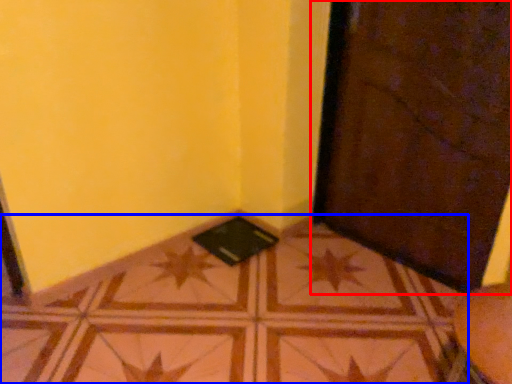
Question: Which of the following is the closest to the observer, door (highlighted by a red box) or tile (highlighted by a blue box)?

Choices:
 (A) door
 (B) tile

Answer: (B)